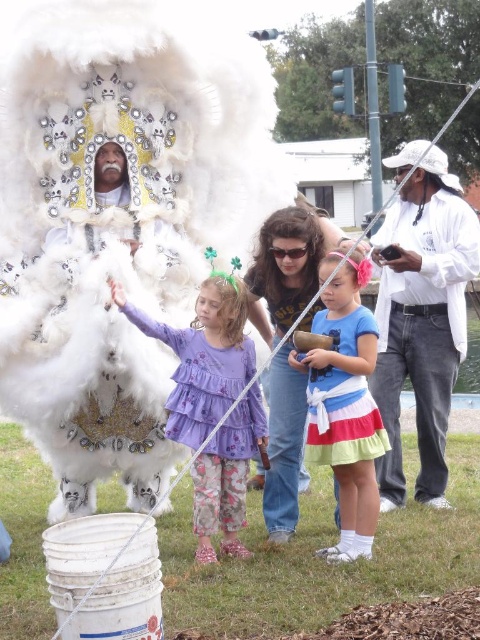
Question: Which object is closer to the camera taking this photo?

Choices:
 (A) denim jeans at center
 (B) multicolored cotton dress at center
 (C) matte blue dress at center
 (D) purple cotton dress at center

Answer: (B)

Question: Is denim jeans at center positioned at the back of multicolored cotton dress at center?

Choices:
 (A) yes
 (B) no

Answer: (A)

Question: Among these objects, which one is farthest from the camera?

Choices:
 (A) multicolored cotton dress at center
 (B) purple cotton dress at center
 (C) purple chiffon dress at center

Answer: (C)

Question: Which is nearer to the purple cotton dress at center?

Choices:
 (A) purple chiffon dress at center
 (B) white fluffy costume at center
 (C) matte blue dress at center
 (D) denim jeans at center

Answer: (A)

Question: Does white fluffy costume at center appear over matte blue dress at center?

Choices:
 (A) yes
 (B) no

Answer: (A)

Question: Does white fluffy costume at center appear on the left side of purple chiffon dress at center?

Choices:
 (A) yes
 (B) no

Answer: (A)